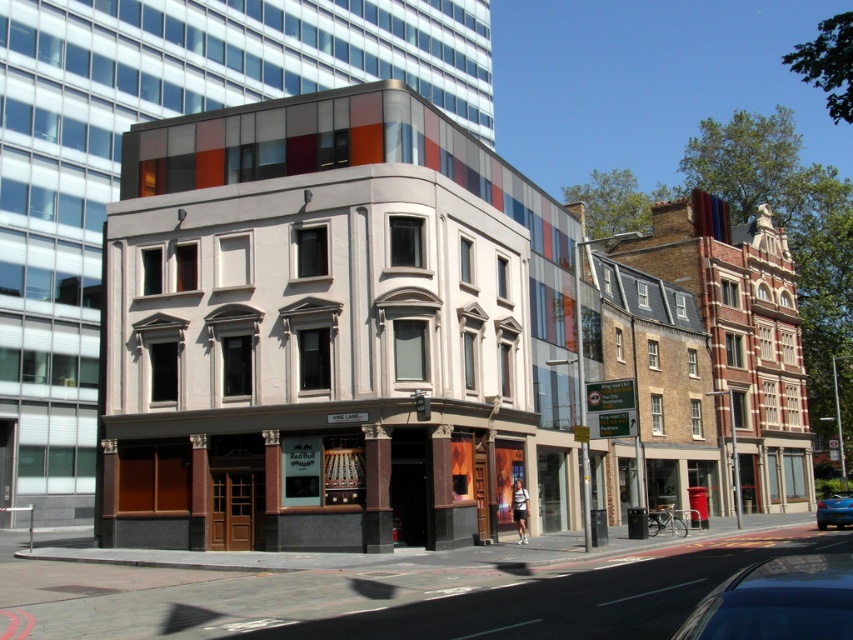
Question: Does metallic blue car at center appear over blue glossy sedan at lower right?

Choices:
 (A) yes
 (B) no

Answer: (A)

Question: Is metallic blue car at center to the right of blue glossy sedan at lower right from the viewer's perspective?

Choices:
 (A) no
 (B) yes

Answer: (A)

Question: Considering the relative positions of metallic blue car at center and blue glossy sedan at lower right in the image provided, where is metallic blue car at center located with respect to blue glossy sedan at lower right?

Choices:
 (A) left
 (B) right

Answer: (A)

Question: Which point is farther to the camera?

Choices:
 (A) (827, 512)
 (B) (848, 621)

Answer: (A)

Question: Which of the following is the farthest from the observer?

Choices:
 (A) (840, 512)
 (B) (729, 616)

Answer: (A)